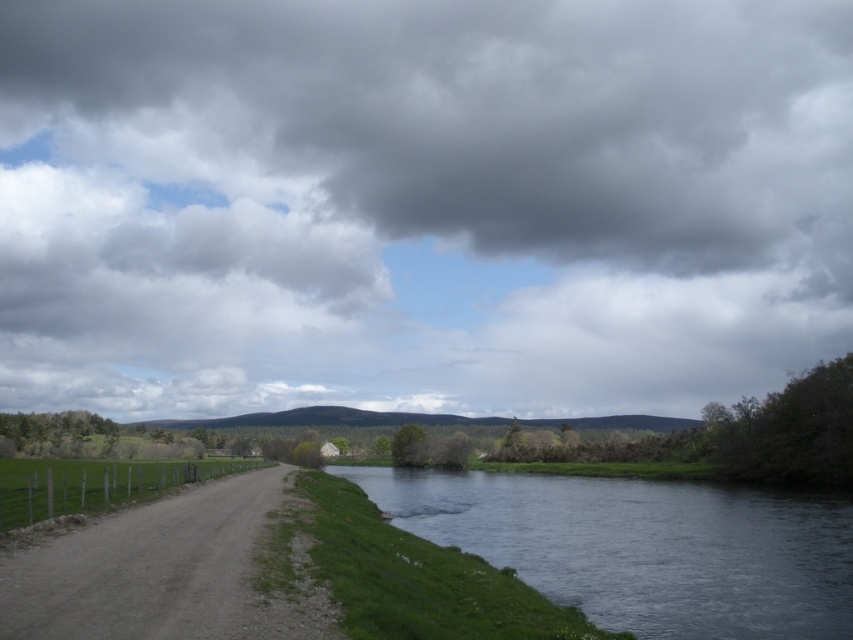
You are a photographer standing at the edge of the dirt path. You want to capture a closeup shot of the dark gray water at lower center. Considering your camera can only focus clearly on objects within 15 meters, will you be able to take the photo without moving closer?

The dark gray water at lower center is 18.44 meters away from the camera. Since the camera can only focus clearly within 15 meters, you will not be able to take a clear closeup shot without moving closer.